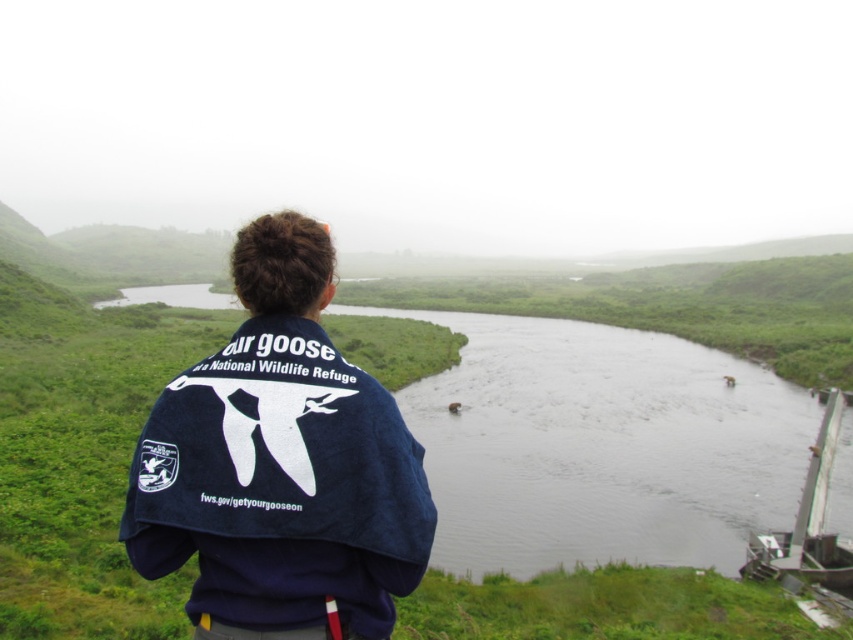
Question: Is the position of dark water at center more distant than that of denim jacket at center?

Choices:
 (A) yes
 (B) no

Answer: (A)

Question: Can you confirm if dark water at center is wider than denim jacket at center?

Choices:
 (A) yes
 (B) no

Answer: (A)

Question: Which point is farther to the camera?

Choices:
 (A) (625, 419)
 (B) (335, 365)

Answer: (A)

Question: Which point is closer to the camera taking this photo?

Choices:
 (A) (776, 516)
 (B) (196, 481)

Answer: (B)

Question: Which of the following is the closest to the observer?

Choices:
 (A) (665, 464)
 (B) (213, 449)

Answer: (B)

Question: Considering the relative positions of dark water at center and denim jacket at center in the image provided, where is dark water at center located with respect to denim jacket at center?

Choices:
 (A) below
 (B) above

Answer: (A)